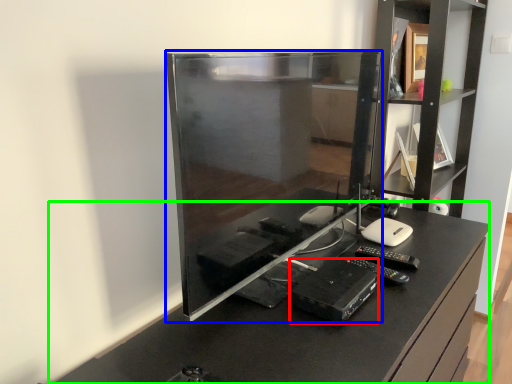
Question: Estimate the real-world distances between objects in this image. Which object is farther from equipment (highlighted by a red box), desktop computer (highlighted by a blue box) or furniture (highlighted by a green box)?

Choices:
 (A) desktop computer
 (B) furniture

Answer: (A)